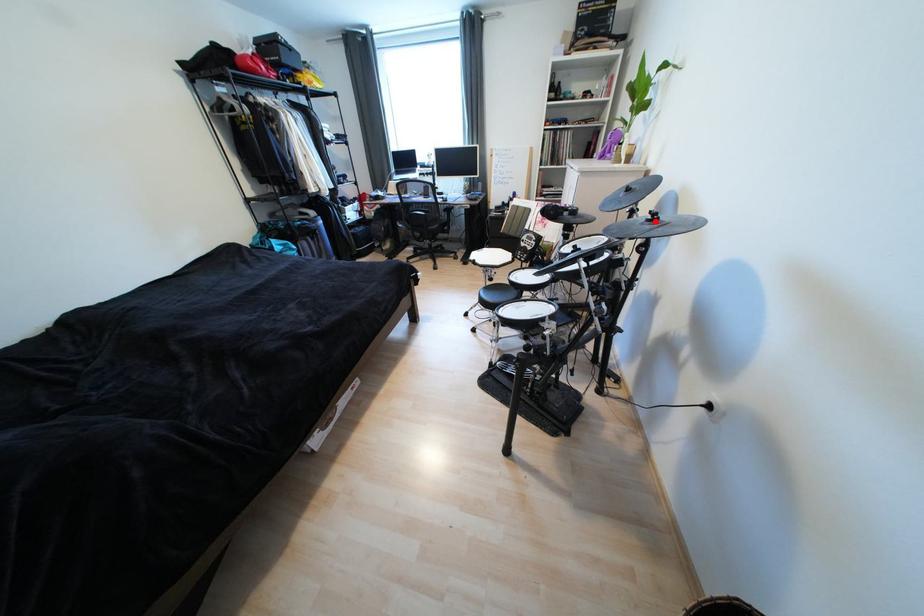
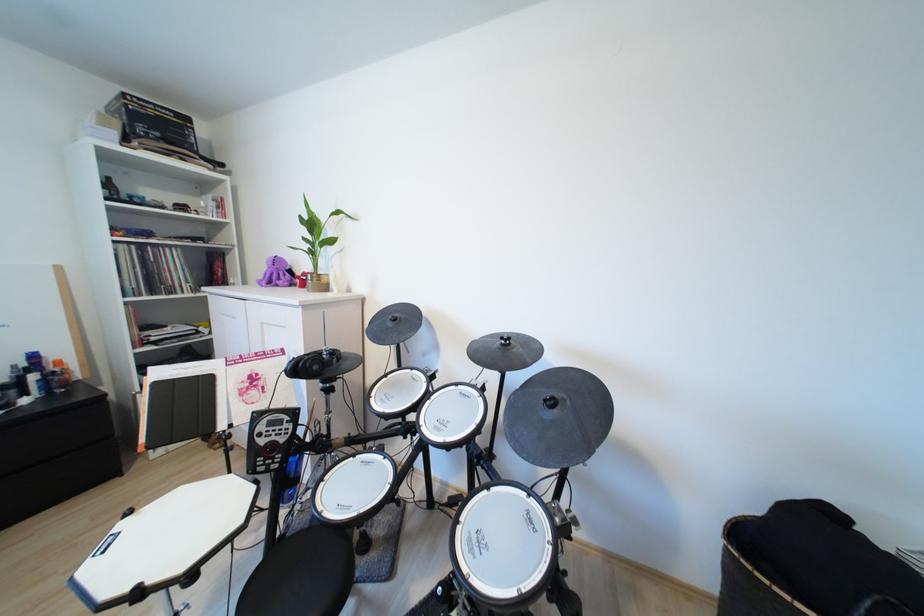
Where in the second image is the point corresponding to the highlighted location from the first image?

(507, 346)